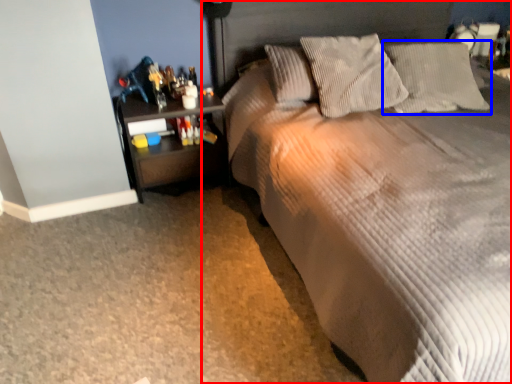
Question: Which point is further to the camera, bed (highlighted by a red box) or pillow (highlighted by a blue box)?

Choices:
 (A) bed
 (B) pillow

Answer: (B)